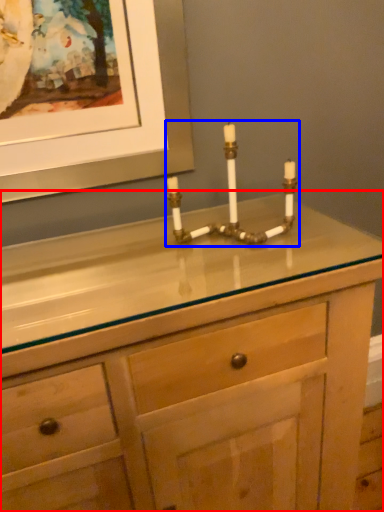
Question: Which point is closer to the camera, chest of drawers (highlighted by a red box) or candle holder (highlighted by a blue box)?

Choices:
 (A) chest of drawers
 (B) candle holder

Answer: (A)